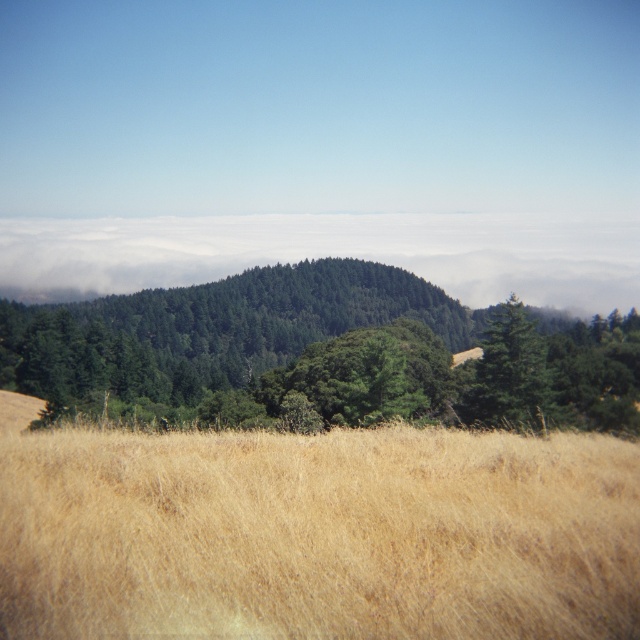
Looking at this image, can you confirm if dry grass at lower center is bigger than green matte tree at center?

No.

Measure the distance between point (x=572, y=468) and camera.

A distance of 9.69 meters exists between point (x=572, y=468) and camera.

Locate an element on the screen. The image size is (640, 640). dry grass at lower center is located at coordinates (317, 534).

Does dry grass at lower center come behind green matte tree at center-right?

No, dry grass at lower center is closer to the viewer.

Find the location of a particular element. This screenshot has height=640, width=640. dry grass at lower center is located at coordinates (317, 534).

The image size is (640, 640). Find the location of `dry grass at lower center`. dry grass at lower center is located at coordinates (317, 534).

Does green matte tree at center have a greater height compared to green matte tree at center-right?

Yes, green matte tree at center is taller than green matte tree at center-right.

Can you confirm if green matte tree at center is shorter than green matte tree at center-right?

Incorrect, green matte tree at center's height does not fall short of green matte tree at center-right's.

The width and height of the screenshot is (640, 640). Find the location of `green matte tree at center`. green matte tree at center is located at coordinates (321, 353).